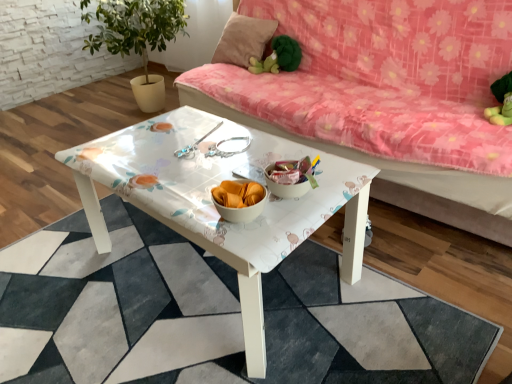
Locate an element on the screen. vacant space underneath white glossy table at center (from a real-world perspective) is located at coordinates (186, 311).